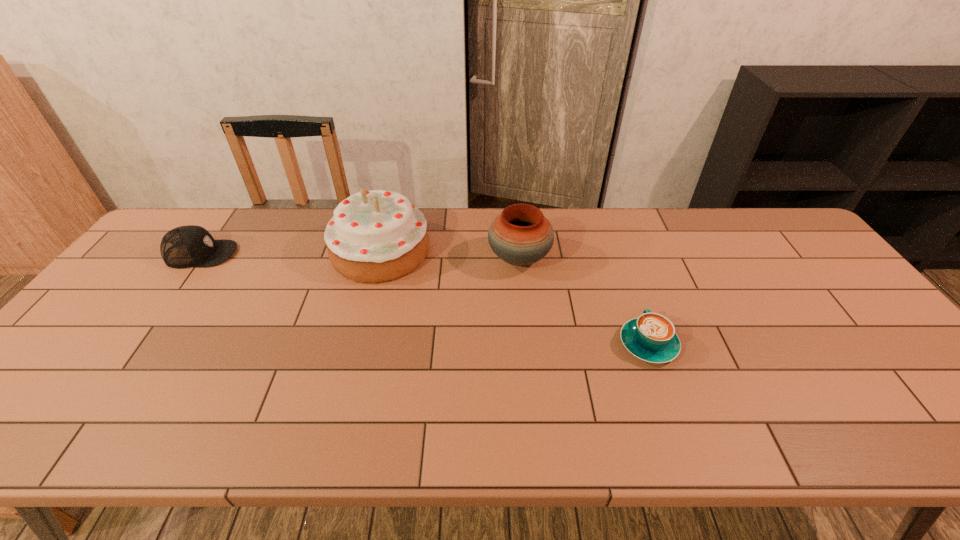
The width and height of the screenshot is (960, 540). I want to click on vacant space that is in between the tallest object and the rightmost object, so click(x=515, y=298).

This screenshot has width=960, height=540. In order to click on free space between the second shortest object and the nearest object in this screenshot , I will do `click(425, 299)`.

Locate which object ranks second in proximity to the nearest object. Please provide its 2D coordinates. Your answer should be formatted as a tuple, i.e. [(x, y)], where the tuple contains the x and y coordinates of a point satisfying the conditions above.

[(375, 236)]

Locate which object ranks in proximity to the third tallest object. Please provide its 2D coordinates. Your answer should be formatted as a tuple, i.e. [(x, y)], where the tuple contains the x and y coordinates of a point satisfying the conditions above.

[(375, 236)]

Find the location of `vacant point that satisfies the following two spatial constraints: 1. on the front-facing side of the cap; 2. with the handle on the right side of the nearest object`. vacant point that satisfies the following two spatial constraints: 1. on the front-facing side of the cap; 2. with the handle on the right side of the nearest object is located at coordinates (136, 344).

Identify the location of vacant area that satisfies the following two spatial constraints: 1. on the front-facing side of the second shortest object; 2. with the handle on the right side of the nearest object. The width and height of the screenshot is (960, 540). (136, 344).

The image size is (960, 540). What are the coordinates of `vacant space that satisfies the following two spatial constraints: 1. on the front-facing side of the third shortest object; 2. on the right side of the third tallest object` in the screenshot? It's located at click(x=198, y=258).